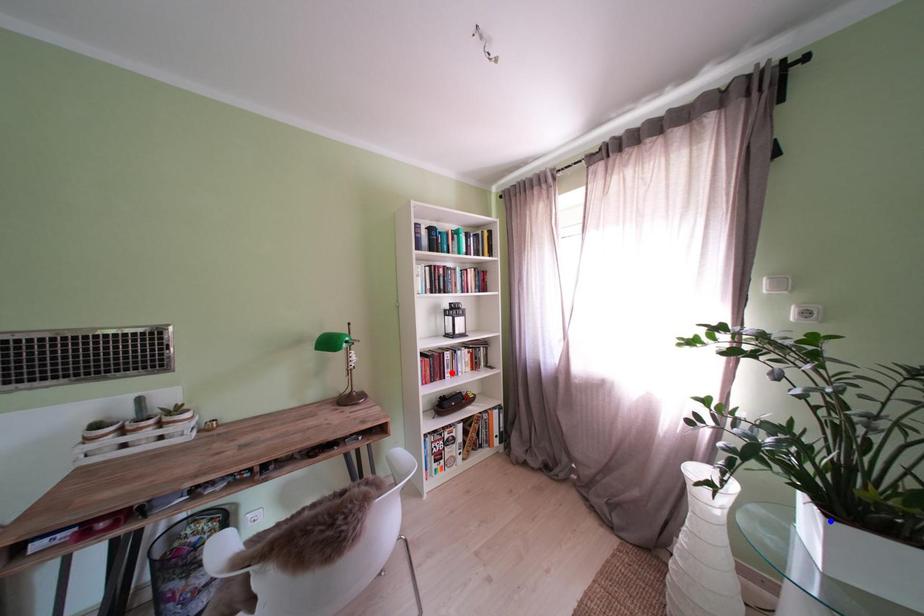
Question: In the image, two points are highlighted. Which point is nearer to the camera? Reply with the corresponding letter.

Choices:
 (A) blue point
 (B) red point

Answer: (A)